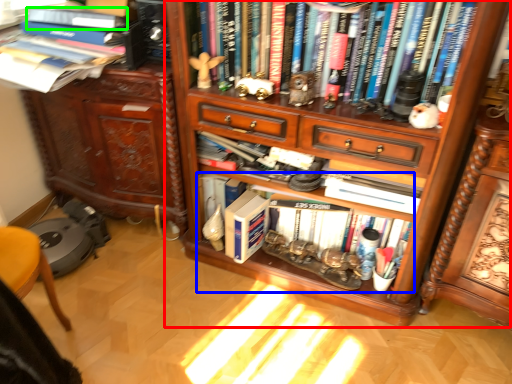
Question: Which object is positioned closest to bookcase (highlighted by a red box)? Select from book (highlighted by a blue box) and book (highlighted by a green box).

Choices:
 (A) book
 (B) book

Answer: (A)